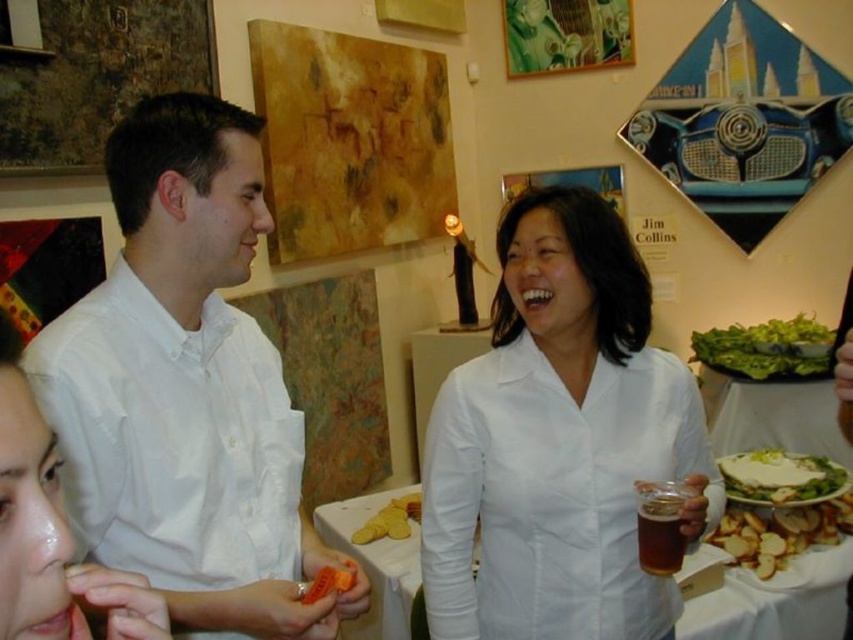
Question: Is the position of green leafy salad at right less distant than that of yellow matte bread at center?

Choices:
 (A) yes
 (B) no

Answer: (B)

Question: Considering the relative positions of white matte shirt at upper left and white creamy cheese at center in the image provided, where is white matte shirt at upper left located with respect to white creamy cheese at center?

Choices:
 (A) below
 (B) above

Answer: (B)

Question: Can you confirm if white smooth shirt at center is smaller than white fabric table at center?

Choices:
 (A) no
 (B) yes

Answer: (A)

Question: Estimate the real-world distances between objects in this image. Which object is closer to the white fabric table at center?

Choices:
 (A) brown glass beer at center
 (B) green leafy salad at right

Answer: (A)

Question: Which object appears closest to the camera in this image?

Choices:
 (A) white smooth shirt at left
 (B) brown glass beer at center
 (C) white creamy cheese at center
 (D) white matte shirt at center

Answer: (A)

Question: Which of the following is the farthest from the observer?

Choices:
 (A) (779, 336)
 (B) (647, 564)
 (C) (229, 180)

Answer: (A)